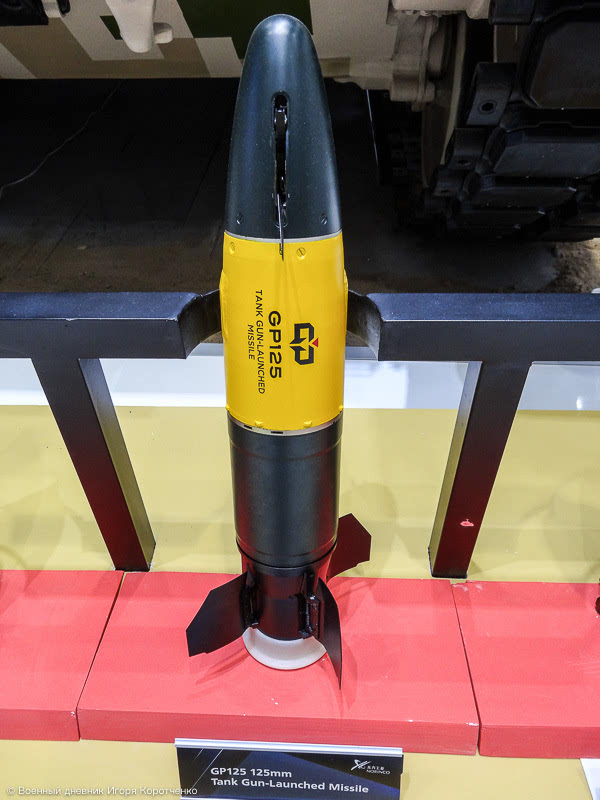
Identify the location of black screws. (320, 221), (240, 218).